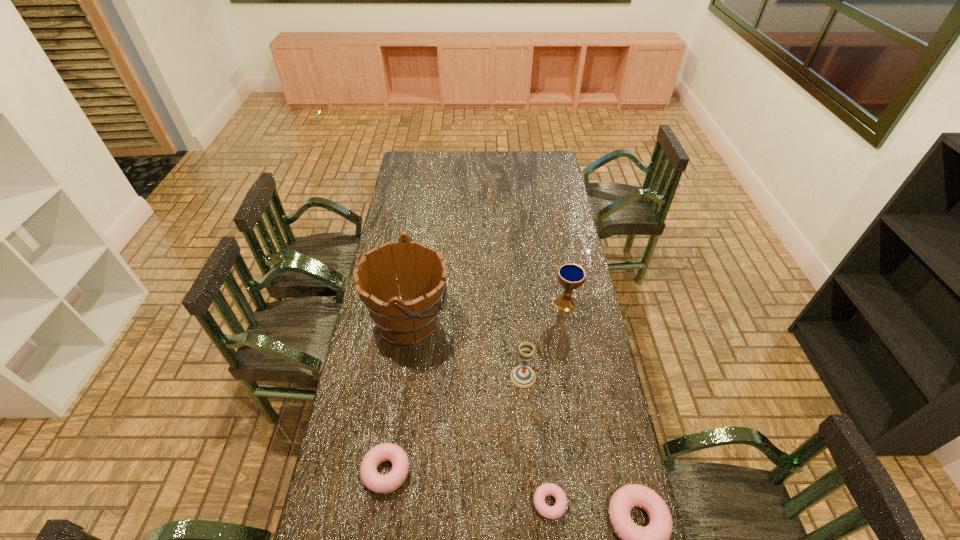
To ensure equal spacing by inserting another doughnut among them, please point out a vacant spot for this new doughnut. Please provide its 2D coordinates. Your answer should be formatted as a tuple, i.e. [(x, y)], where the tuple contains the x and y coordinates of a point satisfying the conditions above.

[(466, 487)]